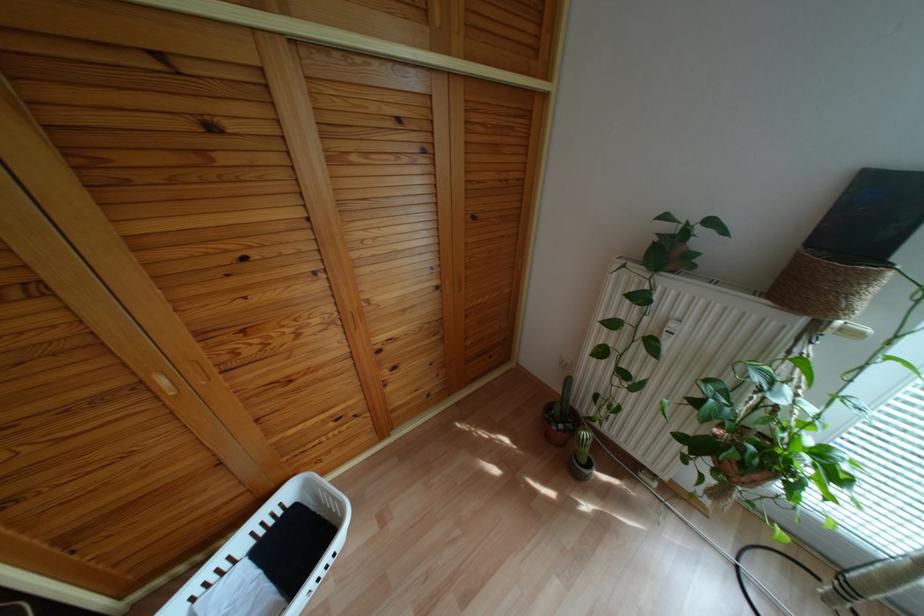
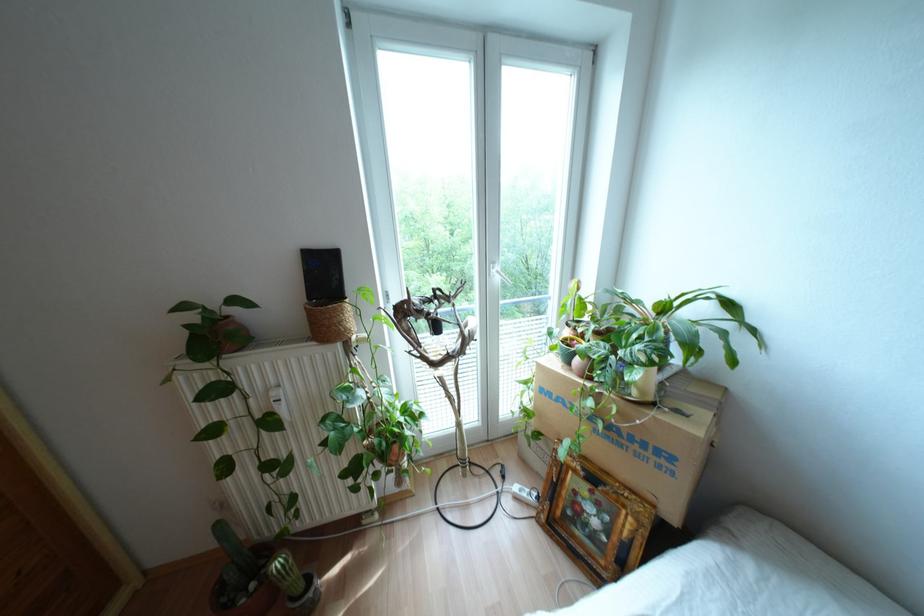
Question: The first image is from the beginning of the video and the second image is from the end. How did the camera likely rotate when shooting the video?

Choices:
 (A) Left
 (B) Right
 (C) Up
 (D) Down

Answer: (B)